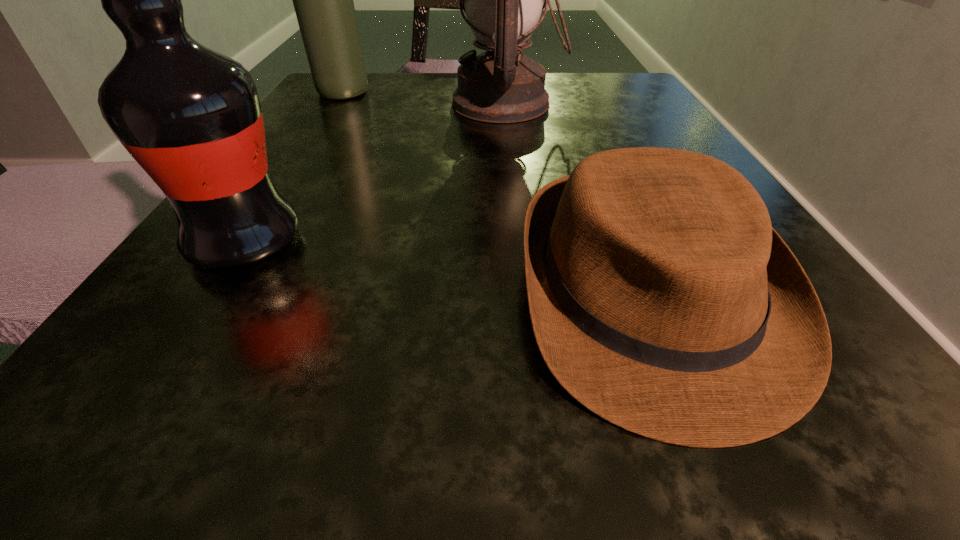
The width and height of the screenshot is (960, 540). Find the location of `blank region between the fedora and the nearer wine bottle`. blank region between the fedora and the nearer wine bottle is located at coordinates (447, 270).

You are a GUI agent. You are given a task and a screenshot of the screen. Output one action in this format:
    pyautogui.click(x=<x>, y=<y>)
    Task: Click on the free space that is in between the nearer wine bottle and the farther wine bottle
    The image size is (960, 540).
    Given the screenshot: What is the action you would take?
    pyautogui.click(x=294, y=167)

Where is `unoccupied position between the nearer wine bottle and the fedora`? unoccupied position between the nearer wine bottle and the fedora is located at coordinates (447, 270).

The image size is (960, 540). What are the coordinates of `free space between the oil lamp and the farther wine bottle` in the screenshot? It's located at (424, 98).

At what (x,y) coordinates should I click in order to perform the action: click on empty space between the farther wine bottle and the oil lamp. Please return your answer as a coordinate pair (x, y). The height and width of the screenshot is (540, 960). Looking at the image, I should click on (424, 98).

Select which object is the second closest to the shortest object. Please provide its 2D coordinates. Your answer should be formatted as a tuple, i.e. [(x, y)], where the tuple contains the x and y coordinates of a point satisfying the conditions above.

[(190, 116)]

Locate an element on the screen. the third closest object relative to the nearer wine bottle is located at coordinates (323, 0).

This screenshot has width=960, height=540. Find the location of `vacant space that satisfies the following two spatial constraints: 1. on the back side of the oil lamp; 2. on the right side of the nearer wine bottle`. vacant space that satisfies the following two spatial constraints: 1. on the back side of the oil lamp; 2. on the right side of the nearer wine bottle is located at coordinates (335, 104).

Locate an element on the screen. blank space that satisfies the following two spatial constraints: 1. on the back side of the oil lamp; 2. on the left side of the nearer wine bottle is located at coordinates (335, 104).

The width and height of the screenshot is (960, 540). I want to click on free space that satisfies the following two spatial constraints: 1. on the front side of the farther wine bottle; 2. on the right side of the oil lamp, so click(x=335, y=104).